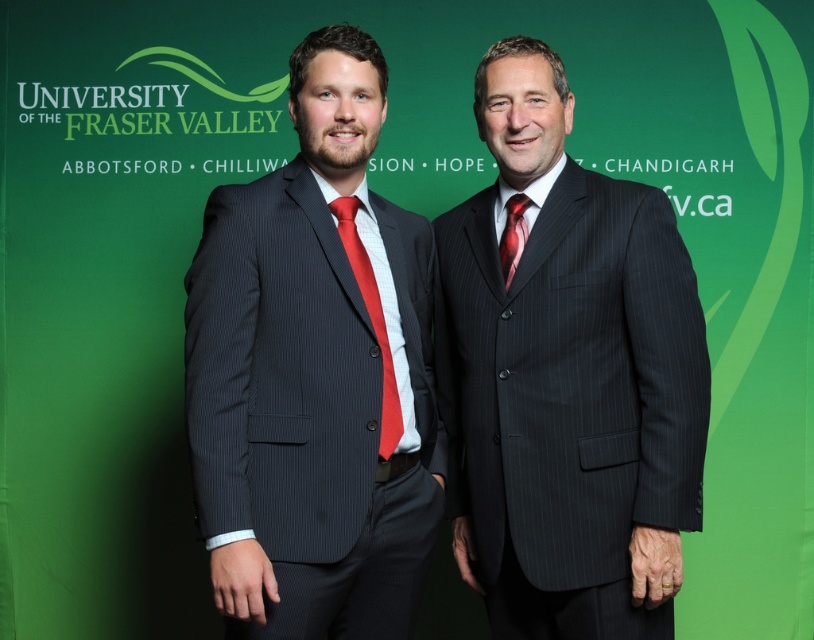
Question: Which of the following is the farthest from the observer?

Choices:
 (A) (374, 260)
 (B) (514, 273)
 (C) (346, 204)
 (D) (506, 220)

Answer: (D)

Question: Which is farther from the matte pinstripe suit at center?

Choices:
 (A) dark pinstripe suit at center
 (B) shiny silk tie at center
 (C) red silk tie at center

Answer: (B)

Question: In this image, where is matte pinstripe suit at center located relative to red silk tie at center?

Choices:
 (A) left
 (B) right

Answer: (A)

Question: Which object is positioned closest to the shiny silk tie at center?

Choices:
 (A) red silk tie at center
 (B) dark pinstripe suit at center

Answer: (B)

Question: Can you confirm if red silk tie at center is smaller than shiny silk tie at center?

Choices:
 (A) no
 (B) yes

Answer: (A)

Question: Is matte pinstripe suit at center to the left of red silk tie at center from the viewer's perspective?

Choices:
 (A) yes
 (B) no

Answer: (A)